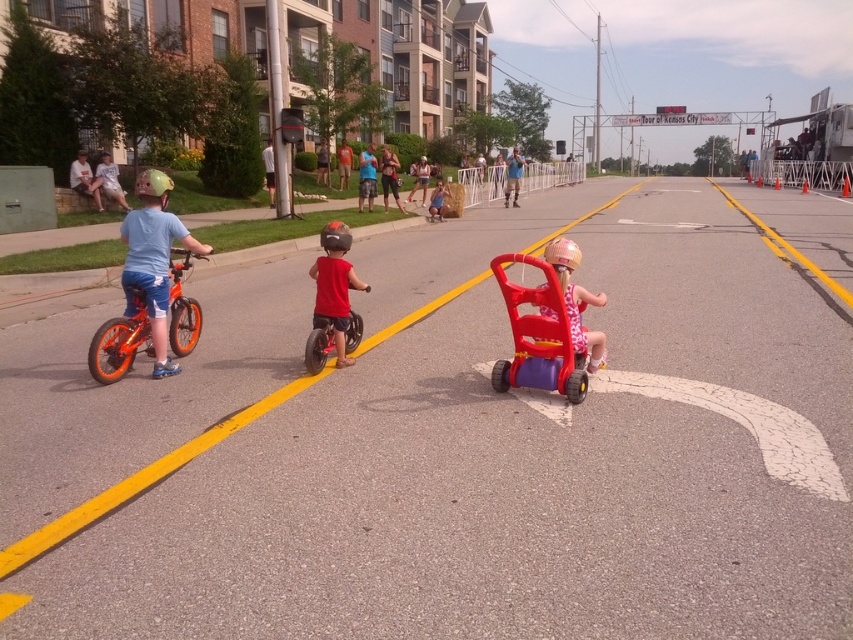
Please provide the coordinates of the rubberized plastic baby carriage at center in the image. The coordinates should be in the format of a point with two decimal places, like point (538, 337). The image is divided into a grid from 0 to 1 on both the x and y axes. The origin is at the bottom left corner of the image. The x axis goes to the right, and the y axis goes up. The objects in the image are the rubberized plastic baby carriage at center and the other objects mentioned in the scene description. The

The coordinates of the rubberized plastic baby carriage at center are point (538, 337).

You are a photographer standing at the starting line of the cycling event. You want to take a photo that includes both the point at coordinates point (563, 275) and point (346, 342). Which point will appear larger in your photo?

Point (563, 275) is closer to the camera than point (346, 342), so it will appear larger in the photo.

You are a city planner designing a new bike lane. You need to ensure that both the rubberized plastic baby carriage at center and the metallic silver bicycle at center can pass through the lane comfortably. What is the minimum width required for the bike lane?

The minimum width required for the bike lane should accommodate the wider of the two objects. Since the rubberized plastic baby carriage at center might be wider than the metallic silver bicycle at center, the bike lane must be at least as wide as the baby carriage to ensure both can pass comfortably.